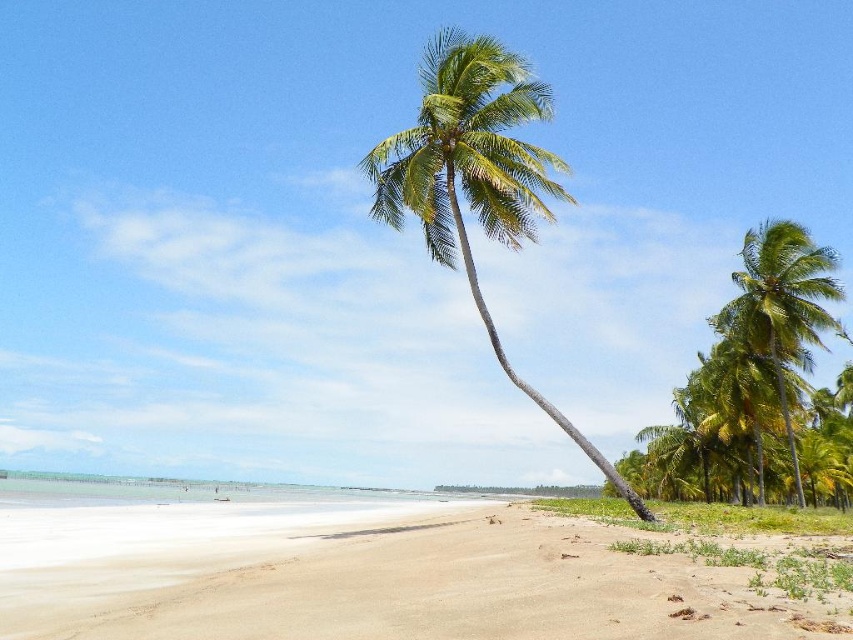
Between sandy beach at lower center and green leafy palm tree at right, which one is positioned higher?

green leafy palm tree at right is above.

Is point (840, 588) positioned in front of point (788, 324)?

Yes.

Where is `sandy beach at lower center`? The image size is (853, 640). sandy beach at lower center is located at coordinates (398, 572).

Is point (416, 138) positioned before point (828, 278)?

Yes.

Which is above, green leafy palm tree at center or green leafy palm tree at right?

Positioned higher is green leafy palm tree at center.

The height and width of the screenshot is (640, 853). I want to click on green leafy palm tree at center, so click(476, 177).

Locate an element on the screen. green leafy palm tree at center is located at coordinates (476, 177).

Measure the distance between point (577,532) and camera.

They are 14.14 meters apart.

Does point (329, 515) come closer to viewer compared to point (526, 156)?

No, it is behind (526, 156).

Which is behind, point (688, 548) or point (527, 164)?

Positioned behind is point (527, 164).

I want to click on sandy beach at lower center, so click(x=398, y=572).